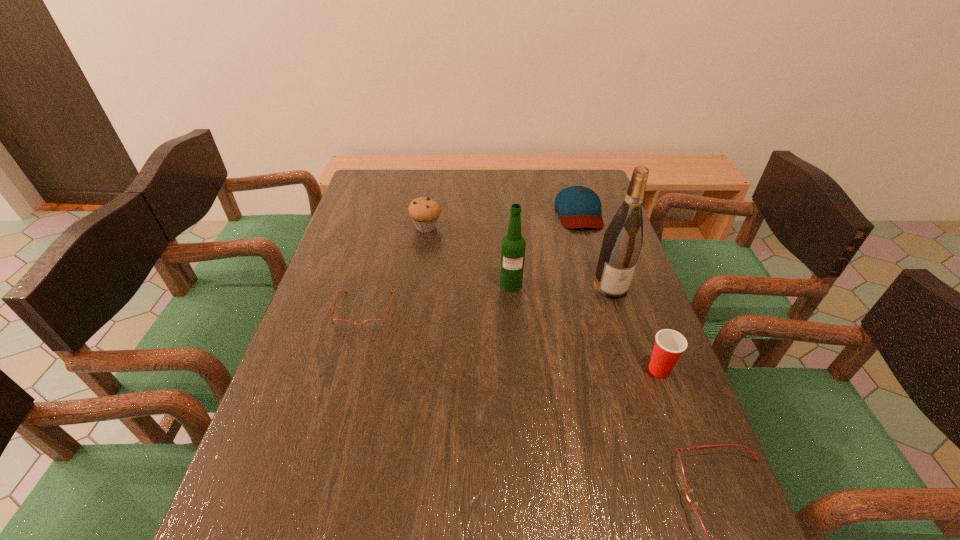
Locate an element on the screen. This screenshot has width=960, height=540. the shorter spectacles is located at coordinates (374, 323).

Locate an element on the screen. the leftmost object is located at coordinates (374, 323).

Find the location of a particular element. This screenshot has width=960, height=540. the fifth tallest object is located at coordinates (x=579, y=207).

Where is `the sixth shortest object`? The width and height of the screenshot is (960, 540). the sixth shortest object is located at coordinates (513, 247).

Locate an element on the screen. The width and height of the screenshot is (960, 540). beer bottle is located at coordinates coord(513,247).

In order to click on wine bottle in this screenshot , I will do `click(623, 239)`.

The height and width of the screenshot is (540, 960). I want to click on the second object from left to right, so 424,212.

This screenshot has height=540, width=960. Identify the location of the sixth farthest object. (669, 345).

I want to click on free space located 0.390m on the lenses of the leftmost object, so click(x=317, y=489).

Locate an element on the screen. vacant space located with the bill of the baseball cap facing forward is located at coordinates (602, 289).